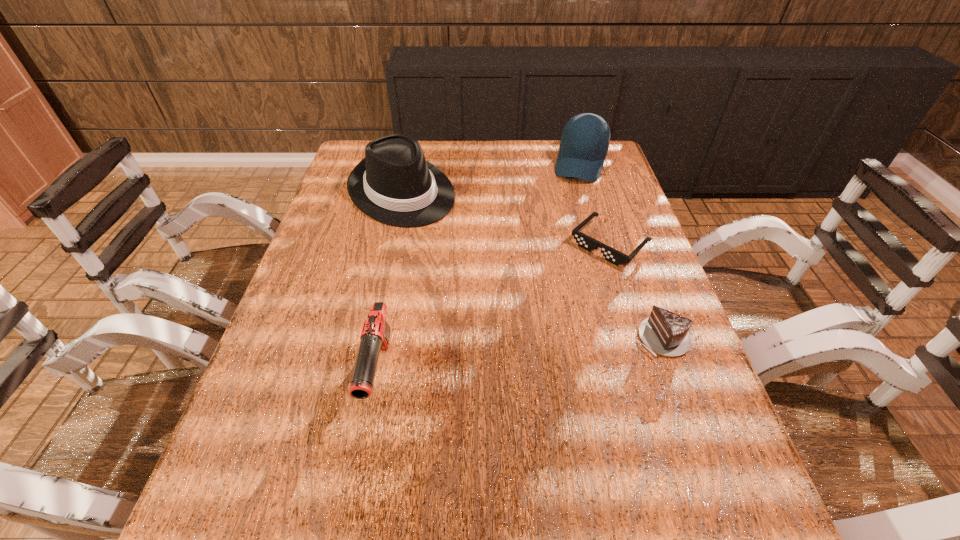
Locate an element on the screen. free space on the desktop that is between the gun and the chocolate cake and is positioned on the front-facing side of the baseball cap is located at coordinates [x=519, y=356].

You are a GUI agent. You are given a task and a screenshot of the screen. Output one action in this format:
    pyautogui.click(x=<x>, y=<y>)
    Task: Click on the free space on the desktop that is between the gun and the second shortest object and is positioned on the front-facing side of the shortest object
    
    Given the screenshot: What is the action you would take?
    pyautogui.click(x=487, y=361)

Locate an element on the screen. This screenshot has height=540, width=960. free space on the desktop that is between the gun and the chocolate cake and is positioned on the front-facing side of the fedora is located at coordinates (562, 351).